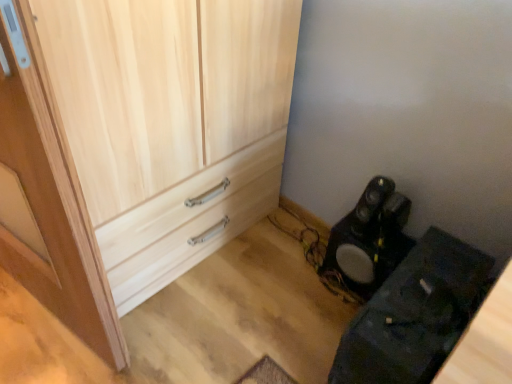
Locate an element on the screen. The height and width of the screenshot is (384, 512). vacant space that's between natural wood cupboard at center and black matte speaker at lower right is located at coordinates (263, 304).